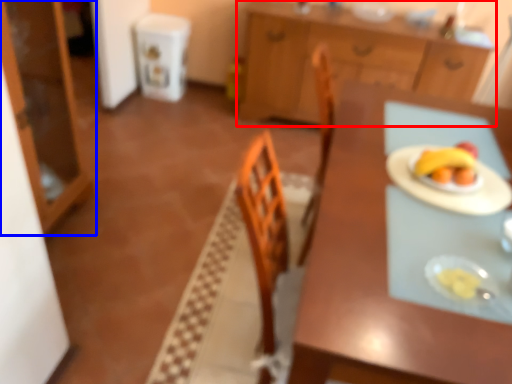
Question: Which of the following is the closest to the observer, cabinetry (highlighted by a red box) or cabinetry (highlighted by a blue box)?

Choices:
 (A) cabinetry
 (B) cabinetry

Answer: (B)